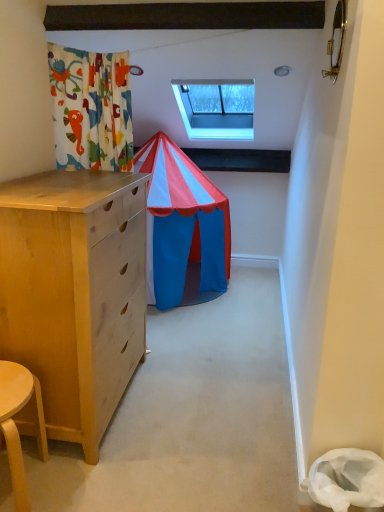
Question: Considering their positions, is transparent glass window at upper center located in front of or behind light wood stool at lower left?

Choices:
 (A) behind
 (B) front

Answer: (A)

Question: From the image's perspective, is transparent glass window at upper center above or below light wood stool at lower left?

Choices:
 (A) above
 (B) below

Answer: (A)

Question: In terms of width, does transparent glass window at upper center look wider or thinner when compared to light wood stool at lower left?

Choices:
 (A) wide
 (B) thin

Answer: (A)

Question: Considering the positions of point (23, 490) and point (218, 121), is point (23, 490) closer or farther from the camera than point (218, 121)?

Choices:
 (A) farther
 (B) closer

Answer: (B)

Question: In the image, is light wood stool at lower left on the left side or the right side of transparent glass window at upper center?

Choices:
 (A) right
 (B) left

Answer: (B)

Question: Considering the positions of light wood stool at lower left and transparent glass window at upper center in the image, is light wood stool at lower left bigger or smaller than transparent glass window at upper center?

Choices:
 (A) small
 (B) big

Answer: (A)

Question: From their relative heights in the image, would you say light wood stool at lower left is taller or shorter than transparent glass window at upper center?

Choices:
 (A) tall
 (B) short

Answer: (B)